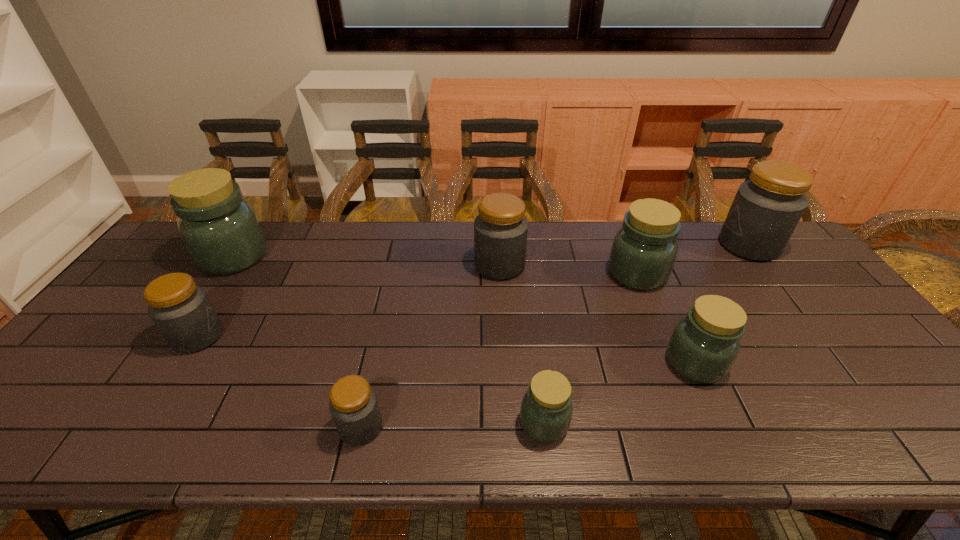
Locate an element on the screen. object identified as the fourth closest to the second biggest gray jar is located at coordinates (354, 407).

Identify which object is the nearest to the second smallest green jar. Please provide its 2D coordinates. Your answer should be formatted as a tuple, i.e. [(x, y)], where the tuple contains the x and y coordinates of a point satisfying the conditions above.

[(643, 253)]

In order to click on the second closest jar to the leftmost green jar in this screenshot , I will do `click(354, 407)`.

Locate which jar is the closest to the rightmost gray jar. Please provide its 2D coordinates. Your answer should be formatted as a tuple, i.e. [(x, y)], where the tuple contains the x and y coordinates of a point satisfying the conditions above.

[(643, 253)]

Where is `gray jar that is the closest one to the third object from left to right`? gray jar that is the closest one to the third object from left to right is located at coordinates (181, 310).

Locate which gray jar is the second closest to the sixth jar from right to left. Please provide its 2D coordinates. Your answer should be formatted as a tuple, i.e. [(x, y)], where the tuple contains the x and y coordinates of a point satisfying the conditions above.

[(500, 230)]

The height and width of the screenshot is (540, 960). Identify the location of the second closest green jar relative to the second green jar from left to right. (643, 253).

Identify which green jar is the nearest to the rightmost object. Please provide its 2D coordinates. Your answer should be formatted as a tuple, i.e. [(x, y)], where the tuple contains the x and y coordinates of a point satisfying the conditions above.

[(643, 253)]

This screenshot has height=540, width=960. I want to click on free location that satisfies the following two spatial constraints: 1. on the surface of the leftmost gray jar near the warning symbol; 2. on the left side of the smallest green jar, so click(143, 423).

You are a GUI agent. You are given a task and a screenshot of the screen. Output one action in this format:
    pyautogui.click(x=<x>, y=<y>)
    Task: Click on the vacant space that satisfies the following two spatial constraints: 1. on the back side of the second smallest green jar; 2. on the surface of the leftmost gray jar near the warning symbol
    This screenshot has width=960, height=540.
    Given the screenshot: What is the action you would take?
    pyautogui.click(x=683, y=336)